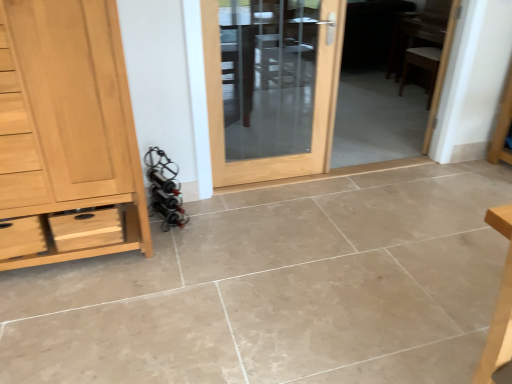
Question: Would you say brown wooden chair at right, which is the second chair from top to bottom, is outside wooden chair at right, acting as the 2th chair starting from the bottom?

Choices:
 (A) no
 (B) yes

Answer: (A)

Question: Are brown wooden chair at right, which is the second chair from top to bottom, and wooden chair at right, which is the first chair in top-to-bottom order, far apart?

Choices:
 (A) no
 (B) yes

Answer: (A)

Question: Is brown wooden chair at right, which is the second chair from top to bottom, further to the viewer compared to wooden chair at right, which is the first chair in top-to-bottom order?

Choices:
 (A) no
 (B) yes

Answer: (B)

Question: Is brown wooden chair at right, placed as the first chair when sorted from bottom to top, touching wooden chair at right, which is the first chair in top-to-bottom order?

Choices:
 (A) no
 (B) yes

Answer: (B)

Question: Does brown wooden chair at right, placed as the first chair when sorted from bottom to top, have a greater width compared to wooden chair at right, which is the first chair in top-to-bottom order?

Choices:
 (A) no
 (B) yes

Answer: (A)

Question: Is brown wooden chair at right, which is the second chair from top to bottom, positioned before wooden chair at right, acting as the 2th chair starting from the bottom?

Choices:
 (A) no
 (B) yes

Answer: (A)

Question: Could you tell me if brown wooden chair at right, placed as the first chair when sorted from bottom to top, is turned towards matte wooden door at center?

Choices:
 (A) no
 (B) yes

Answer: (A)

Question: Is brown wooden chair at right, which is the second chair from top to bottom, thinner than matte wooden door at center?

Choices:
 (A) no
 (B) yes

Answer: (A)

Question: Is brown wooden chair at right, which is the second chair from top to bottom, not inside matte wooden door at center?

Choices:
 (A) yes
 (B) no

Answer: (A)

Question: Is brown wooden chair at right, which is the second chair from top to bottom, wider than matte wooden door at center?

Choices:
 (A) yes
 (B) no

Answer: (A)

Question: From the image's perspective, is brown wooden chair at right, which is the second chair from top to bottom, under matte wooden door at center?

Choices:
 (A) no
 (B) yes

Answer: (A)

Question: Is brown wooden chair at right, placed as the first chair when sorted from bottom to top, placed right next to matte wooden door at center?

Choices:
 (A) no
 (B) yes

Answer: (A)

Question: Is light brown wood chest of drawers at left outside matte wooden door at center?

Choices:
 (A) no
 (B) yes

Answer: (B)